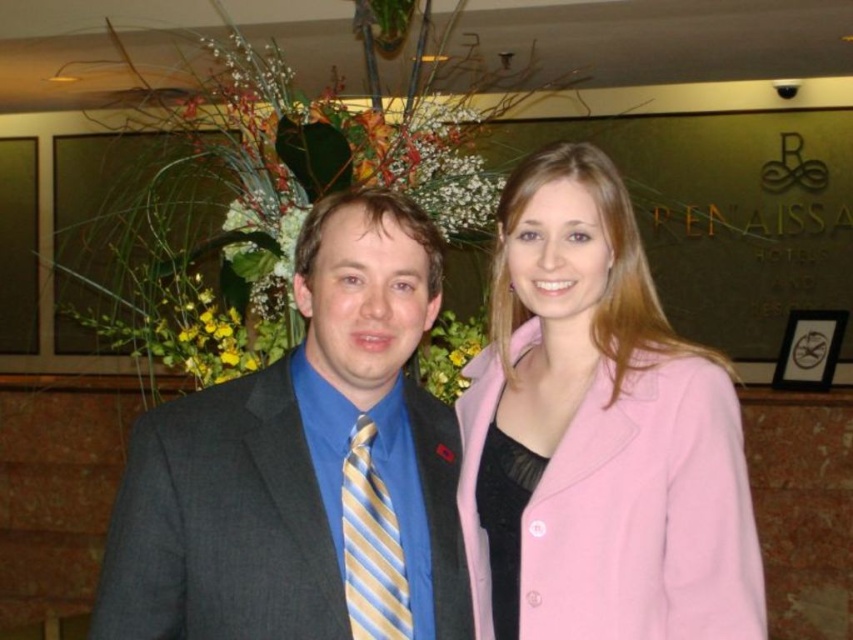
You are a photographer setting up for a group photo. You need to ensure that the matte gray suit at center and the yellow striped tie at center are both visible in the frame. Based on their positions, which object should you focus on first to ensure both are in the shot?

The matte gray suit at center is positioned on the left side of yellow striped tie at center, so focusing on the yellow striped tie at center first will ensure both objects are included in the frame since the matte gray suit at center is to its left.

You are an event planner arranging a photoshoot. You need to ensure that the matte gray suit at center and the yellow striped tie at center are visible in the frame. Based on their positions, which one should you focus on first to make sure both are in the shot?

The matte gray suit at center is above the yellow striped tie at center, so focusing on the matte gray suit at center first will ensure both are in the frame since the tie is positioned below it.